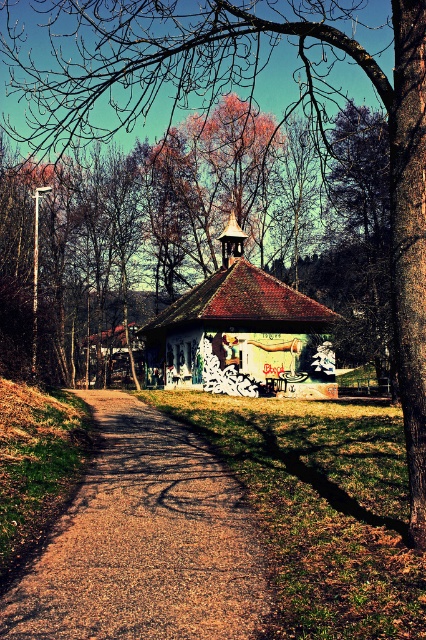
Consider the image. Who is taller, brown gravel path at center or grungy painted hut at center?

With more height is grungy painted hut at center.

How much distance is there between brown gravel path at center and grungy painted hut at center?

70.02 feet

Where is `brown gravel path at center`? The image size is (426, 640). brown gravel path at center is located at coordinates (144, 541).

Identify the location of brown gravel path at center. (144, 541).